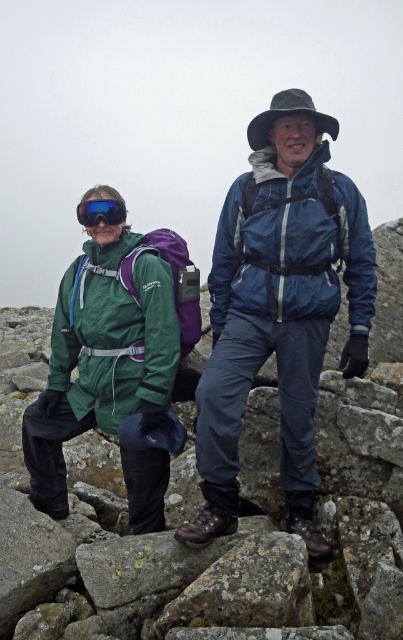
Is point (361, 236) farther from camera compared to point (70, 269)?

No, (361, 236) is in front of (70, 269).

Does green waterproof jacket at center appear over green waterproof jacket at left?

Correct, green waterproof jacket at center is located above green waterproof jacket at left.

Is point (303, 307) positioned in front of point (168, 456)?

Yes, it is in front of point (168, 456).

Where is `green waterproof jacket at center`? green waterproof jacket at center is located at coordinates (280, 307).

Which is in front, point (101, 189) or point (83, 218)?

Point (83, 218) is in front.

Between green waterproof jacket at left and blue reflective goggles at center, which one is positioned higher?

Positioned higher is blue reflective goggles at center.

Find the location of a particular element. The image size is (403, 640). green waterproof jacket at left is located at coordinates (101, 358).

I want to click on green waterproof jacket at center, so click(280, 307).